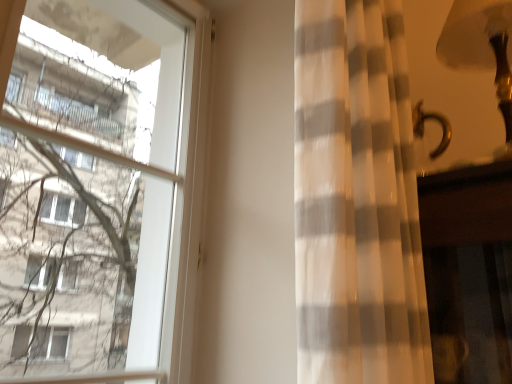
Question: Is gold metallic table lamp at upper right inside or outside of transparent glass window at left?

Choices:
 (A) inside
 (B) outside

Answer: (B)

Question: Considering their positions, is gold metallic table lamp at upper right located in front of or behind transparent glass window at left?

Choices:
 (A) behind
 (B) front

Answer: (A)

Question: Which of these objects is positioned farthest from the gold metallic table lamp at upper right?

Choices:
 (A) transparent glass window at left
 (B) white sheer curtain at right

Answer: (A)

Question: Considering the real-world distances, which object is closest to the white sheer curtain at right?

Choices:
 (A) transparent glass window at left
 (B) gold metallic table lamp at upper right

Answer: (B)